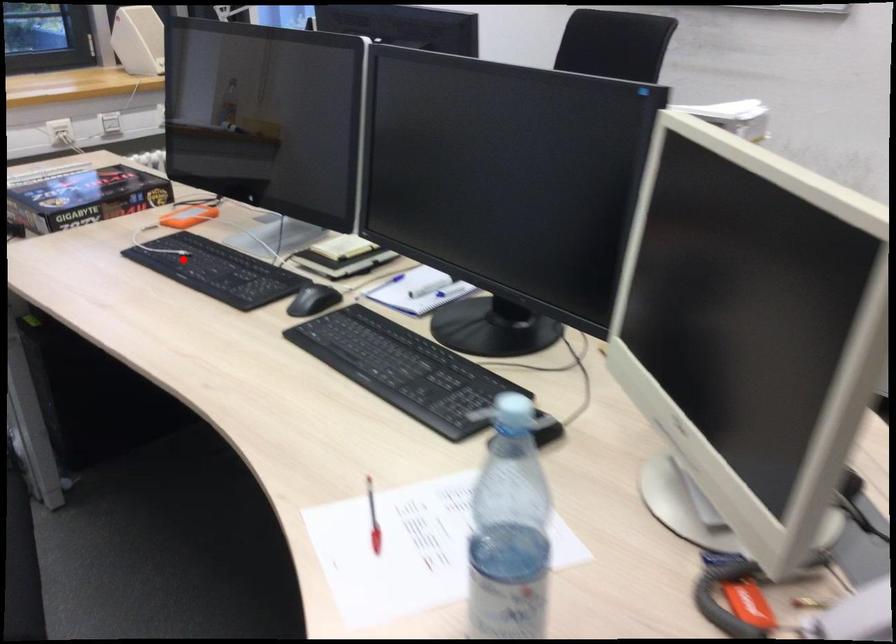
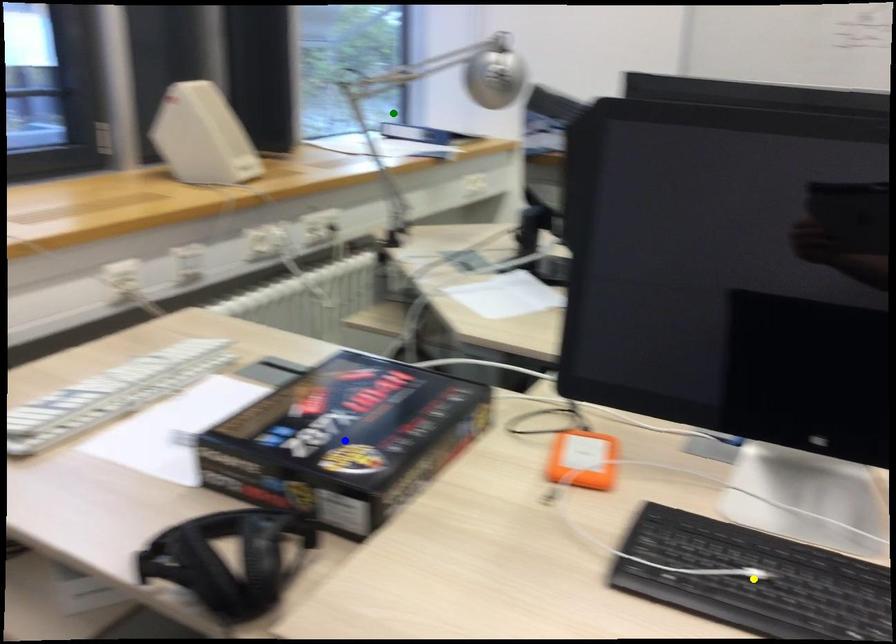
Question: I am providing you with two images of the same scene from different viewpoints. A red point is marked on the first image. You are given multiple points on the second image. In image 2, which mark is for the same physical point as the one in image 1?

Choices:
 (A) green point
 (B) yellow point
 (C) blue point

Answer: (B)